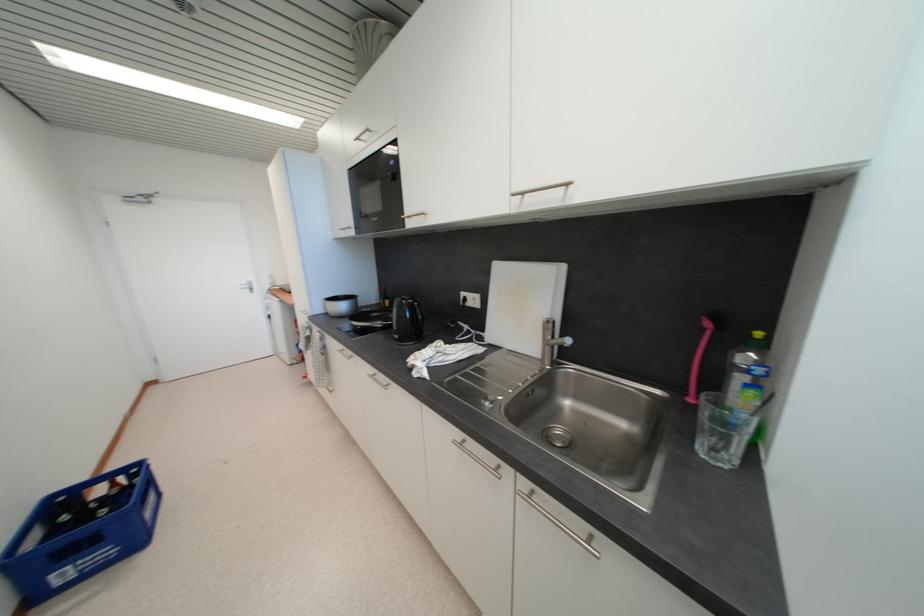
Where would you lift the black kettle handle? Please return your answer as a coordinate pair (x, y).

(406, 323)